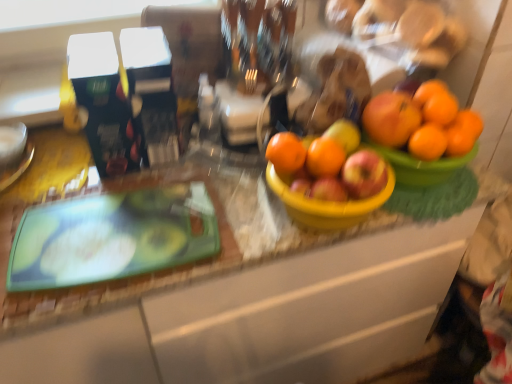
Find the location of a particular element. This screenshot has height=384, width=512. green glossy cutting board at left is located at coordinates (111, 237).

What is the approximate width of green glossy cutting board at left?

green glossy cutting board at left is 9.29 inches wide.

The height and width of the screenshot is (384, 512). Describe the element at coordinates (286, 153) in the screenshot. I see `orange matte at center, which is counted as the 1th orange, starting from the left` at that location.

Find the location of a particular element. This screenshot has height=384, width=512. orange matte at center, which is counted as the 2th orange, starting from the left is located at coordinates (325, 157).

This screenshot has height=384, width=512. In order to click on orange matte at right, which is the 1th orange in right-to-left order in this screenshot , I will do `click(428, 142)`.

How different are the orientations of red matte apple at center and green glossy cutting board at left in degrees?

7.56 degrees.

Considering the relative sizes of red matte apple at center and green glossy cutting board at left in the image provided, is red matte apple at center shorter than green glossy cutting board at left?

Incorrect, the height of red matte apple at center does not fall short of that of green glossy cutting board at left.

Considering the relative positions of red matte apple at center and green glossy cutting board at left in the image provided, is red matte apple at center behind green glossy cutting board at left?

Yes, it is behind green glossy cutting board at left.

Is orange matte at right, acting as the fourth orange starting from the left, next to orange matte at upper right, arranged as the third orange when viewed from the left, and touching it?

Yes, orange matte at right, acting as the fourth orange starting from the left, is touching orange matte at upper right, arranged as the third orange when viewed from the left.

Which object is positioned more to the left, orange matte at right, which is the 1th orange in right-to-left order, or orange matte at upper right, which is counted as the second orange, starting from the right?

From the viewer's perspective, orange matte at upper right, which is counted as the second orange, starting from the right, appears more on the left side.

From the image's perspective, is orange matte at right, acting as the fourth orange starting from the left, beneath orange matte at upper right, which is counted as the second orange, starting from the right?

Yes, from the image's perspective, orange matte at right, acting as the fourth orange starting from the left, is below orange matte at upper right, which is counted as the second orange, starting from the right.

Can orange matte at upper right, which is counted as the second orange, starting from the right, be found inside red matte apple at center?

No, orange matte at upper right, which is counted as the second orange, starting from the right, is not inside red matte apple at center.

Is red matte apple at center oriented towards orange matte at upper right, arranged as the third orange when viewed from the left?

No, red matte apple at center is not turned towards orange matte at upper right, arranged as the third orange when viewed from the left.

Starting from the red matte apple at center, which orange is the 4th one behind? Please provide its 2D coordinates.

[(391, 118)]

Considering the relative positions of red matte apple at center and orange matte at upper right, arranged as the third orange when viewed from the left, in the image provided, is red matte apple at center to the left or to the right of orange matte at upper right, arranged as the third orange when viewed from the left,?

red matte apple at center is positioned on orange matte at upper right, arranged as the third orange when viewed from the left,'s left side.

Is orange matte at upper right, which is counted as the second orange, starting from the right, inside or outside of orange matte at center, positioned as the third orange in right-to-left order?

orange matte at upper right, which is counted as the second orange, starting from the right, cannot be found inside orange matte at center, positioned as the third orange in right-to-left order.

Is point (387, 119) positioned before point (310, 144)?

That is True.

Who is taller, orange matte at upper right, arranged as the third orange when viewed from the left, or orange matte at center, which is counted as the 2th orange, starting from the left?

orange matte at upper right, arranged as the third orange when viewed from the left, is taller.

Considering the positions of objects orange matte at upper right, arranged as the third orange when viewed from the left, and orange matte at center, positioned as the third orange in right-to-left order, in the image provided, who is in front, orange matte at upper right, arranged as the third orange when viewed from the left, or orange matte at center, positioned as the third orange in right-to-left order,?

orange matte at center, positioned as the third orange in right-to-left order.

From the image's perspective, between orange matte at center, which appears as the fourth orange when viewed from the right, and orange matte at upper right, arranged as the third orange when viewed from the left, who is located below?

orange matte at center, which appears as the fourth orange when viewed from the right.

Which of these two, orange matte at center, which appears as the fourth orange when viewed from the right, or orange matte at upper right, which is counted as the second orange, starting from the right, stands taller?

Standing taller between the two is orange matte at upper right, which is counted as the second orange, starting from the right.

Considering the sizes of orange matte at center, which is counted as the 1th orange, starting from the left, and orange matte at upper right, arranged as the third orange when viewed from the left, in the image, is orange matte at center, which is counted as the 1th orange, starting from the left, bigger or smaller than orange matte at upper right, arranged as the third orange when viewed from the left,?

Considering their sizes, orange matte at center, which is counted as the 1th orange, starting from the left, takes up less space than orange matte at upper right, arranged as the third orange when viewed from the left.

From the picture: Which of these two, orange matte at center, which is counted as the 1th orange, starting from the left, or orange matte at upper right, which is counted as the second orange, starting from the right, is wider?

Wider between the two is orange matte at upper right, which is counted as the second orange, starting from the right.

Is orange matte at right, which is the 1th orange in right-to-left order, taller or shorter than orange matte at center, which is counted as the 2th orange, starting from the left?

orange matte at right, which is the 1th orange in right-to-left order, is taller than orange matte at center, which is counted as the 2th orange, starting from the left.

From a real-world perspective, between orange matte at right, acting as the fourth orange starting from the left, and orange matte at center, which is counted as the 2th orange, starting from the left, who is vertically higher?

orange matte at right, acting as the fourth orange starting from the left, is physically above.

Is point (420, 156) closer or farther from the camera than point (325, 158)?

Point (420, 156) appears to be farther away from the viewer than point (325, 158).

Considering the relative positions of orange matte at right, acting as the fourth orange starting from the left, and orange matte at center, positioned as the third orange in right-to-left order, in the image provided, is orange matte at right, acting as the fourth orange starting from the left, to the right of orange matte at center, positioned as the third orange in right-to-left order, from the viewer's perspective?

Yes, orange matte at right, acting as the fourth orange starting from the left, is to the right of orange matte at center, positioned as the third orange in right-to-left order.

Between red matte apple at center and orange matte at center, which is counted as the 1th orange, starting from the left, which one is positioned behind?

orange matte at center, which is counted as the 1th orange, starting from the left, is more distant.

In order to click on apple below the orange matte at center, which appears as the fourth orange when viewed from the right (from the image's perspective) in this screenshot , I will do `click(364, 174)`.

Consider the image. Considering the sizes of objects red matte apple at center and orange matte at center, which is counted as the 1th orange, starting from the left, in the image provided, who is bigger, red matte apple at center or orange matte at center, which is counted as the 1th orange, starting from the left,?

red matte apple at center is bigger.

Is red matte apple at center at the right side of orange matte at center, which appears as the fourth orange when viewed from the right?

Indeed, red matte apple at center is positioned on the right side of orange matte at center, which appears as the fourth orange when viewed from the right.

The height and width of the screenshot is (384, 512). What are the coordinates of `apple behind the green glossy cutting board at left` in the screenshot? It's located at (364, 174).

At what (x,y) coordinates should I click in order to perform the action: click on orange that is the 1st one when counting forward from the orange matte at upper right, arranged as the third orange when viewed from the left. Please return your answer as a coordinate pair (x, y). This screenshot has height=384, width=512. Looking at the image, I should click on (428, 142).

Which object lies further to the anchor point orange matte at center, which is counted as the 1th orange, starting from the left, orange matte at right, which is the 1th orange in right-to-left order, or green glossy cutting board at left?

Based on the image, green glossy cutting board at left appears to be further to orange matte at center, which is counted as the 1th orange, starting from the left.

Looking at this image, from the image, which object appears to be farther from orange matte at center, which appears as the fourth orange when viewed from the right, red matte apple at center or green glossy cutting board at left?

green glossy cutting board at left lies further to orange matte at center, which appears as the fourth orange when viewed from the right, than the other object.

Based on their spatial positions, is orange matte at center, which is counted as the 1th orange, starting from the left, or orange matte at center, positioned as the third orange in right-to-left order, closer to orange matte at upper right, which is counted as the second orange, starting from the right?

orange matte at center, positioned as the third orange in right-to-left order, is positioned closer to the anchor orange matte at upper right, which is counted as the second orange, starting from the right.

Based on the photo, looking at the image, which one is located further to orange matte at center, which is counted as the 2th orange, starting from the left, orange matte at upper right, arranged as the third orange when viewed from the left, or orange matte at right, acting as the fourth orange starting from the left?

orange matte at right, acting as the fourth orange starting from the left, is positioned further to the anchor orange matte at center, which is counted as the 2th orange, starting from the left.

When comparing their distances from orange matte at upper right, which is counted as the second orange, starting from the right, does red matte apple at center or orange matte at center, which appears as the fourth orange when viewed from the right, seem closer?

red matte apple at center is closer to orange matte at upper right, which is counted as the second orange, starting from the right.

Based on their spatial positions, is red matte apple at center or green glossy cutting board at left closer to orange matte at center, which is counted as the 2th orange, starting from the left?

red matte apple at center is positioned closer to the anchor orange matte at center, which is counted as the 2th orange, starting from the left.

Estimate the real-world distances between objects in this image. Which object is closer to orange matte at right, which is the 1th orange in right-to-left order, red matte apple at center or green glossy cutting board at left?

Based on the image, red matte apple at center appears to be nearer to orange matte at right, which is the 1th orange in right-to-left order.

When comparing their distances from orange matte at center, which appears as the fourth orange when viewed from the right, does green glossy cutting board at left or orange matte at center, which is counted as the 2th orange, starting from the left, seem further?

green glossy cutting board at left.

The image size is (512, 384). Find the location of `orange located between green glossy cutting board at left and orange matte at center, which is counted as the 2th orange, starting from the left, in the left-right direction`. orange located between green glossy cutting board at left and orange matte at center, which is counted as the 2th orange, starting from the left, in the left-right direction is located at coordinates (286, 153).

This screenshot has height=384, width=512. I want to click on orange located between orange matte at center, positioned as the third orange in right-to-left order, and orange matte at right, which is the 1th orange in right-to-left order, in the left-right direction, so point(391,118).

You are a GUI agent. You are given a task and a screenshot of the screen. Output one action in this format:
    pyautogui.click(x=<x>, y=<y>)
    Task: Click on the apple between green glossy cutting board at left and orange matte at upper right, arranged as the third orange when viewed from the left, in the horizontal direction
    This screenshot has width=512, height=384.
    Given the screenshot: What is the action you would take?
    pyautogui.click(x=364, y=174)

At what (x,y) coordinates should I click in order to perform the action: click on apple between orange matte at center, positioned as the third orange in right-to-left order, and orange matte at upper right, which is counted as the second orange, starting from the right. Please return your answer as a coordinate pair (x, y). Image resolution: width=512 pixels, height=384 pixels. Looking at the image, I should click on (364, 174).